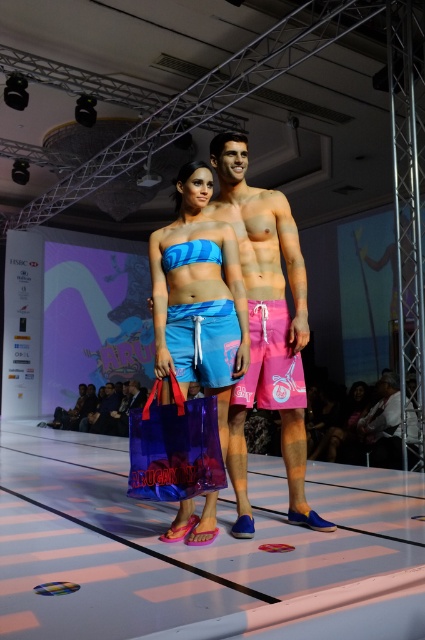
The width and height of the screenshot is (425, 640). In order to click on pink matte swim shorts at center in this screenshot , I will do `click(266, 326)`.

Is pink matte swim shorts at center taller than transparent purple shopping bag at center?

Yes, pink matte swim shorts at center is taller than transparent purple shopping bag at center.

Is point (291, 445) more distant than point (220, 449)?

Yes, point (291, 445) is behind point (220, 449).

Where is `pink matte swim shorts at center`? pink matte swim shorts at center is located at coordinates (266, 326).

Can you confirm if transparent purple shopping bag at center is positioned above blue fabric shorts at center?

Incorrect, transparent purple shopping bag at center is not positioned above blue fabric shorts at center.

Measure the distance between transparent purple shopping bag at center and blue fabric shorts at center.

transparent purple shopping bag at center is 12.78 inches away from blue fabric shorts at center.

The height and width of the screenshot is (640, 425). I want to click on transparent purple shopping bag at center, so click(175, 448).

The image size is (425, 640). I want to click on transparent purple shopping bag at center, so click(175, 448).

Can you confirm if pink matte swim shorts at center is smaller than blue matte swimsuit at center?

No, pink matte swim shorts at center is not smaller than blue matte swimsuit at center.

Does pink matte swim shorts at center have a lesser width compared to blue matte swimsuit at center?

No, pink matte swim shorts at center is not thinner than blue matte swimsuit at center.

Is point (292, 493) closer to camera compared to point (220, 397)?

No.

I want to click on pink matte swim shorts at center, so click(x=266, y=326).